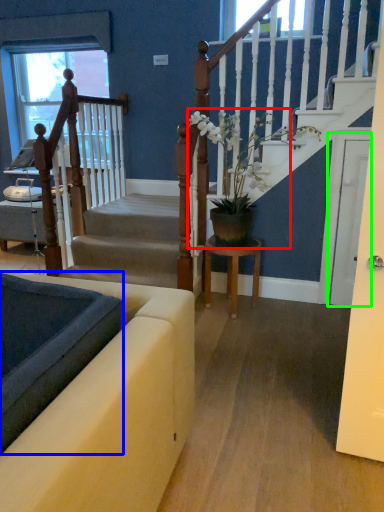
Question: Considering the real-world distances, which object is closest to houseplant (highlighted by a red box)? landing (highlighted by a blue box) or glass door (highlighted by a green box).

Choices:
 (A) landing
 (B) glass door

Answer: (B)